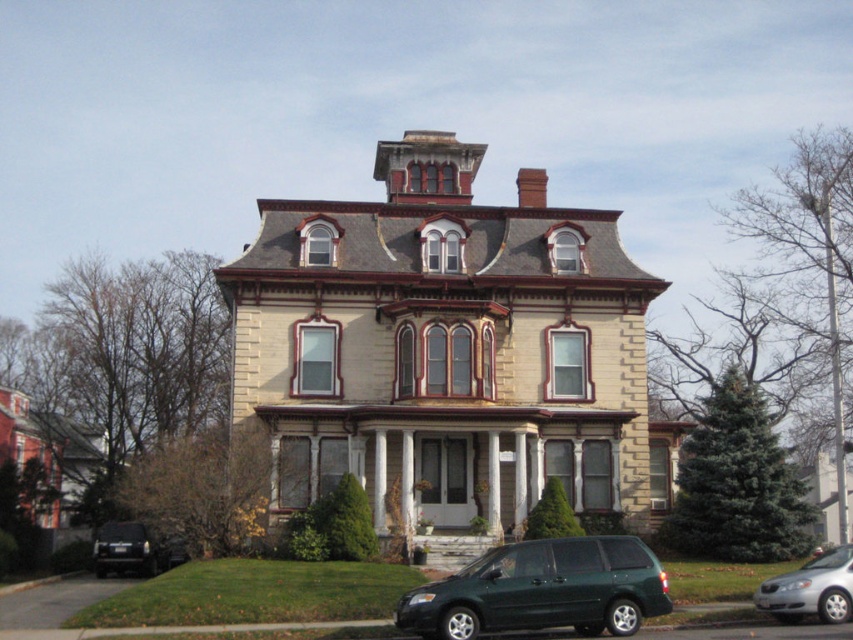
You are standing in front of the Victorian house and need to park your car. You see a green matte van at lower center and a silver metallic sedan at lower right. Which vehicle is parked closer to the entrance of the house?

The green matte van at lower center is closer to the viewer, so it is parked closer to the entrance of the house than the silver metallic sedan at lower right.